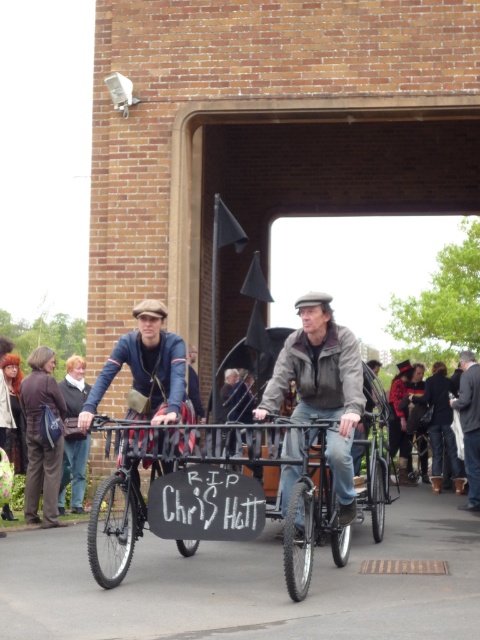
You are a photographer trying to capture a photo of the matte blue jacket at center and the wooden coach at center. Since you want to ensure both are in focus, you need to know which object is taller. Can you tell me which one is taller?

The wooden coach at center is taller than the matte blue jacket at center because the matte blue jacket at center is not as tall as the wooden coach at center.

You are a delivery person needing to navigate through a narrow alley that is 1.8 meters wide. You see the black matte bicycle at center and the wooden coach at center in the scene. Can both items fit side by side in the alley without overlapping?

The black matte bicycle at center might be wider than wooden coach at center. If the bicycle is wider than 0.9 meters, they cannot fit side by side in the 1.8 meter alley. However, if the bicycle is narrower, they might fit. The exact width isn

Where is the matte blue jacket at center located in the image?

The matte blue jacket at center is located at point 0.580 on the x axis and 0.304 on the y axis.